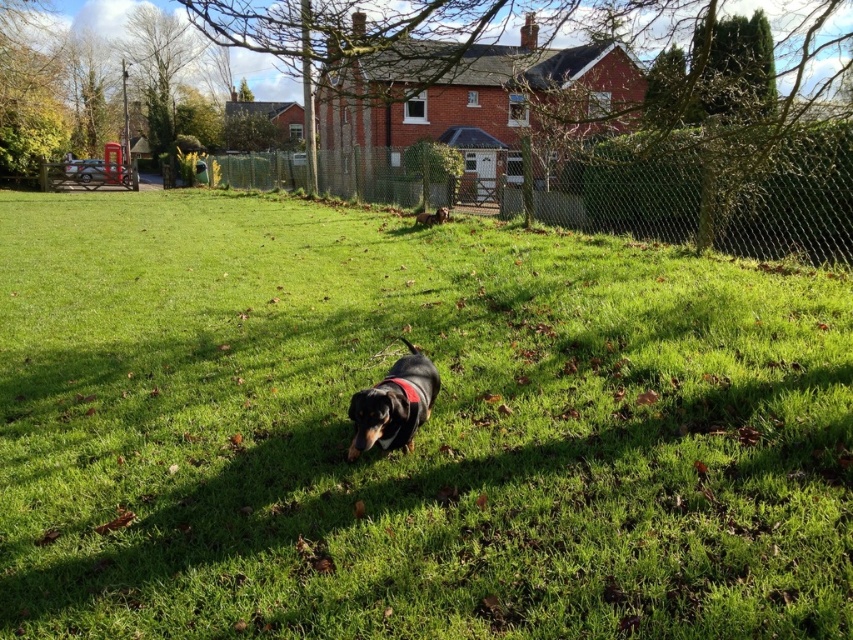
You are a photographer setting up a shot of the dog in the scene. You want to ensure the green grassy at center and the wire mesh fence at upper center are both visible. Which object should you focus on to include both in the frame without cropping either?

Since the green grassy at center occupies less space than the wire mesh fence at upper center, you should focus on the wire mesh fence at upper center to ensure both objects are included in the frame without cropping either.

You are a photographer trying to capture a clear shot of the green grassy area at center and the wire mesh fence at upper center. Since you want the fence to be in focus, should you adjust your focus to be closer to the green grassy at center or further away from it?

The green grassy at center is in front of the wire mesh fence at upper center. To focus on the fence, you need to adjust your focus further away from the green grassy at center so that the fence comes into sharp focus.